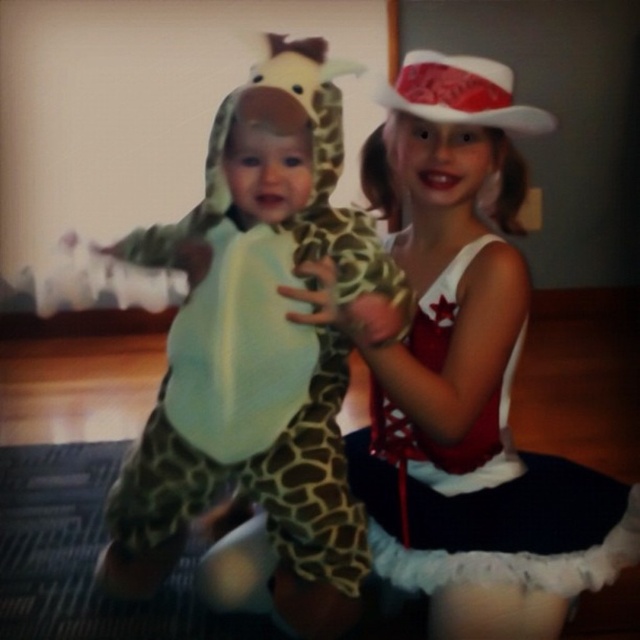
Question: Is matte white dress at center smaller than spotted fabric giraffe at left?

Choices:
 (A) no
 (B) yes

Answer: (A)

Question: Which point is farther to the camera?

Choices:
 (A) spotted fabric giraffe at left
 (B) white felt cowboy hat at upper center

Answer: (B)

Question: Estimate the real-world distances between objects in this image. Which object is closer to the matte white dress at center?

Choices:
 (A) white felt cowboy hat at upper center
 (B) spotted fabric giraffe at left

Answer: (B)

Question: Which point is farther from the camera taking this photo?

Choices:
 (A) (244, 184)
 (B) (413, 588)

Answer: (B)

Question: Is matte white dress at center above white felt cowboy hat at upper center?

Choices:
 (A) no
 (B) yes

Answer: (A)

Question: Does matte white dress at center appear on the left side of white felt cowboy hat at upper center?

Choices:
 (A) yes
 (B) no

Answer: (A)